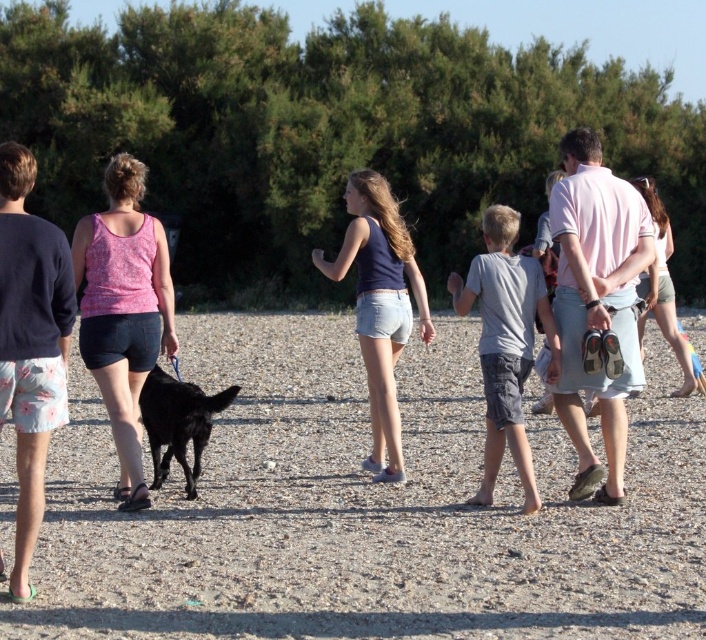
How distant is pink printed tank top at center-left from black matte dog at center?

The distance of pink printed tank top at center-left from black matte dog at center is 52.79 centimeters.

Is pink printed tank top at center-left positioned in front of black matte dog at center?

Yes.

The width and height of the screenshot is (706, 640). What do you see at coordinates (124, 310) in the screenshot?
I see `pink printed tank top at center-left` at bounding box center [124, 310].

Image resolution: width=706 pixels, height=640 pixels. I want to click on pink printed tank top at center-left, so click(x=124, y=310).

Looking at this image, between gray cotton shirt at center and navy blue denim shorts at center, which one appears on the left side from the viewer's perspective?

navy blue denim shorts at center

Based on the photo, can you confirm if gray cotton shirt at center is positioned above navy blue denim shorts at center?

No.

Who is more forward, (517,330) or (388,285)?

Point (517,330)

You are a GUI agent. You are given a task and a screenshot of the screen. Output one action in this format:
    pyautogui.click(x=<x>, y=<y>)
    Task: Click on the gray cotton shirt at center
    The image size is (706, 640).
    Given the screenshot: What is the action you would take?
    pyautogui.click(x=505, y=342)

Can you confirm if pink cotton shirt at right is bigger than pink printed tank top at center-left?

No, pink cotton shirt at right is not bigger than pink printed tank top at center-left.

Measure the distance between pink cotton shirt at right and camera.

The distance of pink cotton shirt at right from camera is 8.72 meters.

Locate an element on the screen. pink cotton shirt at right is located at coordinates (597, 301).